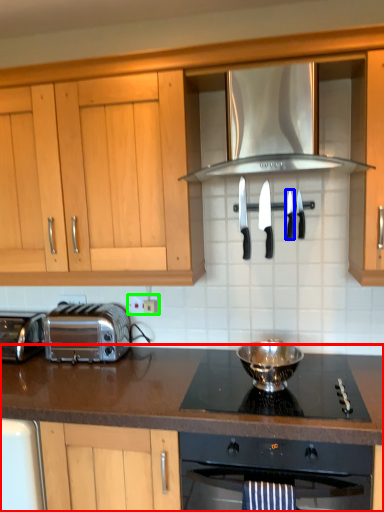
Question: Which is farther away from countertop (highlighted by a red box)? knife (highlighted by a blue box) or electric outlet (highlighted by a green box)?

Choices:
 (A) knife
 (B) electric outlet

Answer: (A)